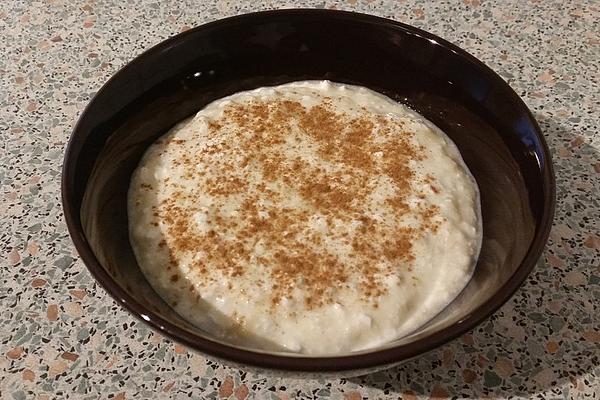
Image resolution: width=600 pixels, height=400 pixels. Find the location of `countertop top right of bowl`. countertop top right of bowl is located at coordinates (537, 32).